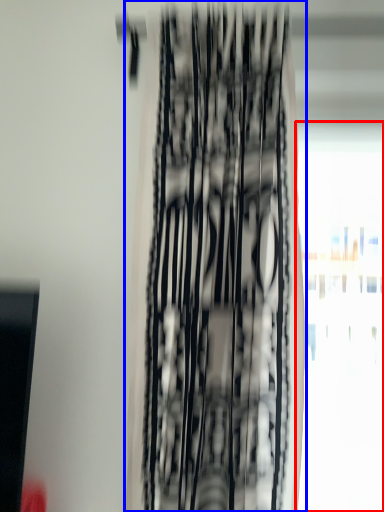
Question: Which of the following is the farthest to the observer, window (highlighted by a red box) or curtain (highlighted by a blue box)?

Choices:
 (A) window
 (B) curtain

Answer: (A)